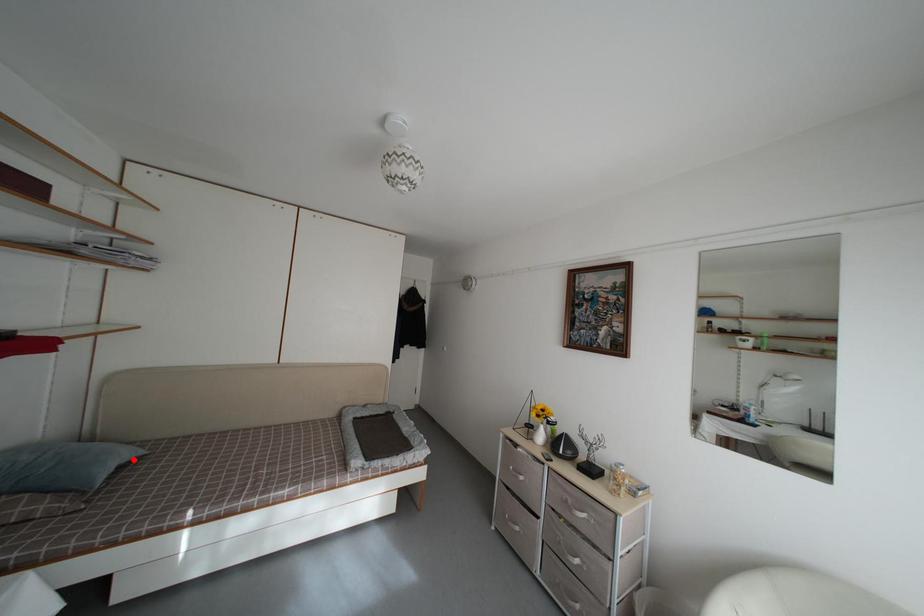
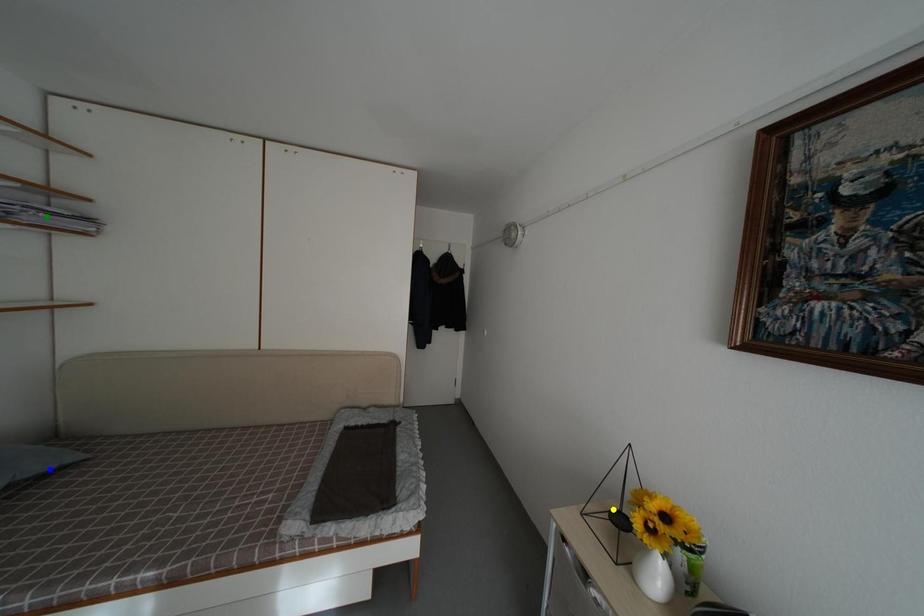
Question: I am providing you with two images of the same scene from different viewpoints. A red point is marked on the first image. You are given multiple points on the second image. Which mark in image 2 goes with the point in image 1?

Choices:
 (A) green point
 (B) blue point
 (C) yellow point

Answer: (B)